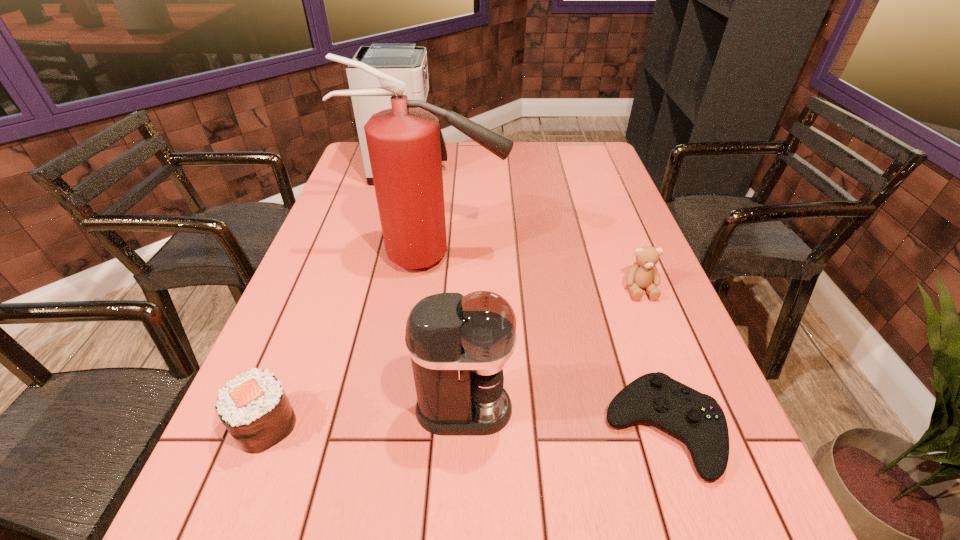
At what (x,y) coordinates should I click in order to perform the action: click on the fifth nearest object. Please return your answer as a coordinate pair (x, y). Looking at the image, I should click on (403, 142).

This screenshot has width=960, height=540. What are the coordinates of `fire extinguisher` in the screenshot? It's located at (403, 142).

At what (x,y) coordinates should I click in order to perform the action: click on the farthest object. Please return your answer as a coordinate pair (x, y). This screenshot has width=960, height=540. Looking at the image, I should click on (406, 61).

Where is `the farther coffee maker`? The height and width of the screenshot is (540, 960). the farther coffee maker is located at coordinates (406, 61).

Locate an element on the screen. The image size is (960, 540). the nearer coffee maker is located at coordinates (458, 345).

Where is `the shorter coffee maker`? The height and width of the screenshot is (540, 960). the shorter coffee maker is located at coordinates (458, 345).

At what (x,y) coordinates should I click in order to perform the action: click on the third farthest object. Please return your answer as a coordinate pair (x, y). Looking at the image, I should click on pyautogui.click(x=643, y=274).

In order to click on sushi in this screenshot , I will do `click(254, 408)`.

Identify the location of the shortest object. The image size is (960, 540). (696, 419).

Identify the location of vacant space located 0.120m at the nozzle of the fifth nearest object. (552, 258).